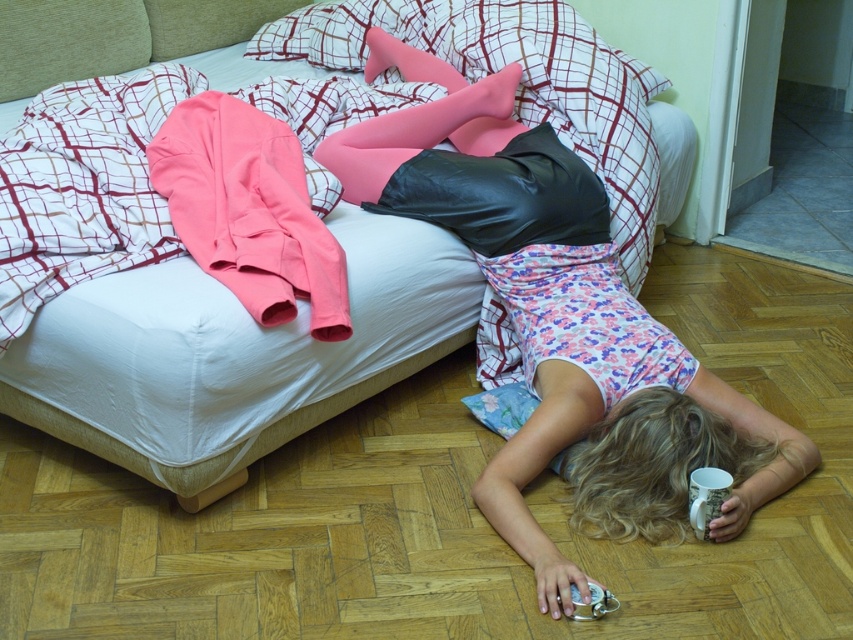
You are a housekeeper entering the room and need to make the bed. The bed has a duvet and pillowcases. Which object, the white cotton bed at upper center or the pink fabric jacket at upper left, should you move first to access the bed for making?

The pink fabric jacket at upper left should be moved first because the white cotton bed at upper center is larger in size and likely covers more of the bed, making it necessary to clear the smaller pink fabric jacket at upper left first to access the bed properly.

You are a delivery person who needs to place a package on the bed in the image. Can you confirm the exact location of the white cotton bed at upper center to ensure the package is delivered correctly?

The white cotton bed at upper center is located at coordinates point (190, 404), so you should place the package there.